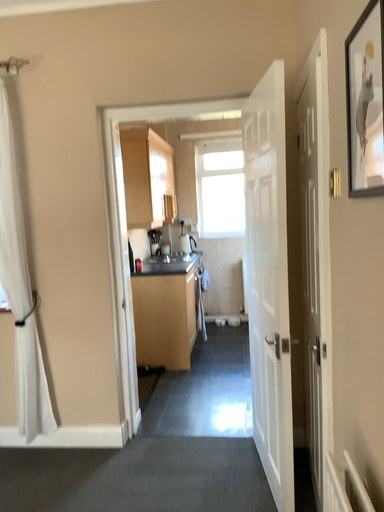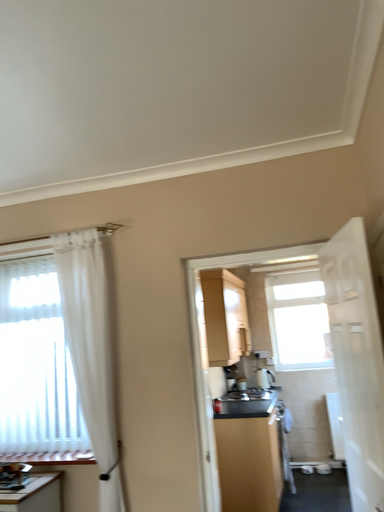
Question: How did the camera likely rotate when shooting the video?

Choices:
 (A) rotated upward
 (B) rotated downward

Answer: (A)